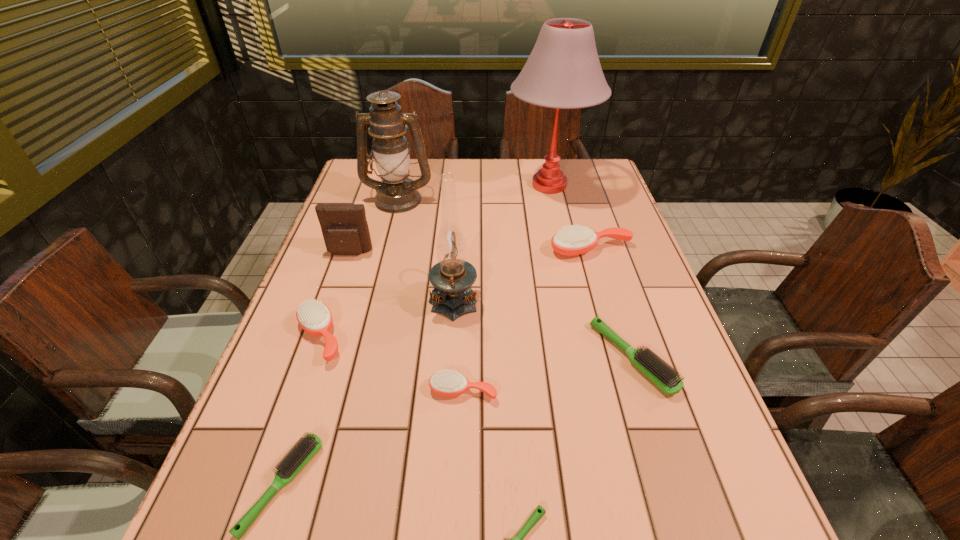
Where is `object at the far right corner`? Image resolution: width=960 pixels, height=540 pixels. object at the far right corner is located at coordinates (563, 71).

Where is `vacant space at the far edge of the desktop`? vacant space at the far edge of the desktop is located at coordinates (534, 194).

Identify the location of free space at the left edge of the desktop. The width and height of the screenshot is (960, 540). (329, 290).

Find the location of a particular element. This screenshot has height=540, width=960. free space at the right edge of the desktop is located at coordinates (596, 214).

The height and width of the screenshot is (540, 960). In the image, there is a desktop. What are the coordinates of `vacant space at the far left corner` in the screenshot? It's located at (379, 180).

At what (x,y) coordinates should I click in order to perform the action: click on vacant area between the tallest object and the rightmost light hairbrush. Please return your answer as a coordinate pair (x, y). Looking at the image, I should click on (591, 272).

Identify the location of vacant space that's between the left oil lamp and the light table lamp. The image size is (960, 540). (474, 192).

Where is `blank region between the second nearest orange hairbrush and the right oil lamp`? This screenshot has height=540, width=960. blank region between the second nearest orange hairbrush and the right oil lamp is located at coordinates (387, 317).

Identify the location of free space that is in between the nearest orange hairbrush and the pouch. This screenshot has width=960, height=540. (406, 322).

At what (x,y) coordinates should I click in order to perform the action: click on vacant area that lies between the table lamp and the tallest hairbrush. Please return your answer as a coordinate pair (x, y). Looking at the image, I should click on (570, 218).